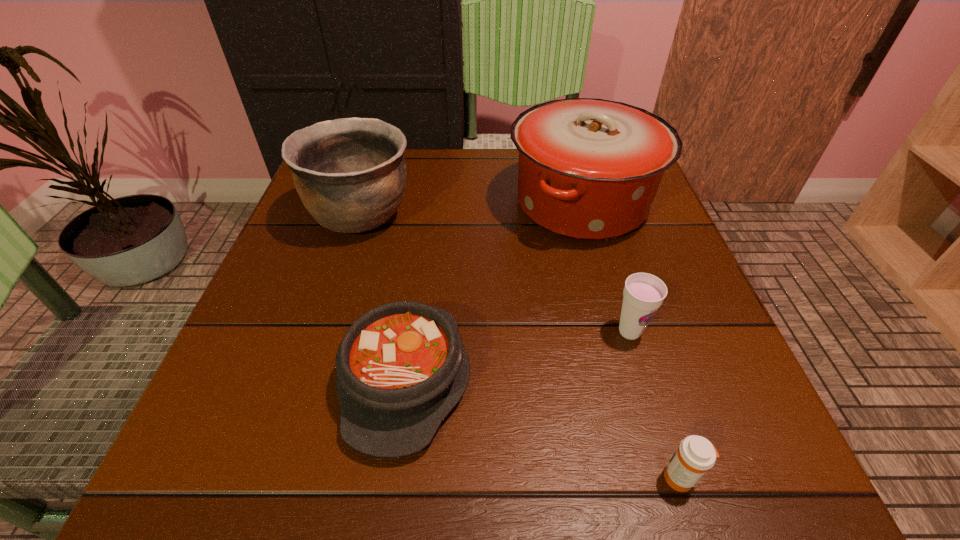
Locate an element on the screen. The height and width of the screenshot is (540, 960). vacant area that lies between the cup and the taller casserole is located at coordinates [x=606, y=267].

In order to click on unoccupied area between the medicine and the third tallest object in this screenshot , I will do `click(655, 404)`.

Identify the location of vacant space in between the tallest object and the medicine. (631, 340).

The image size is (960, 540). What are the coordinates of `empty space that is in between the pottery and the nearer casserole` in the screenshot? It's located at (383, 296).

Where is `empty space between the medicine and the third shortest object`? empty space between the medicine and the third shortest object is located at coordinates (655, 404).

Where is `free spot between the medicine and the nearer casserole`? Image resolution: width=960 pixels, height=540 pixels. free spot between the medicine and the nearer casserole is located at coordinates (543, 428).

Find the location of a particular element. The width and height of the screenshot is (960, 540). free space between the medicine and the taller casserole is located at coordinates (631, 340).

Find the location of `free space between the farther casserole and the cup`. free space between the farther casserole and the cup is located at coordinates (606, 267).

You are a GUI agent. You are given a task and a screenshot of the screen. Output one action in this format:
    pyautogui.click(x=<x>, y=<y>)
    Task: Click on the free space between the left casserole and the third tallest object
    The height and width of the screenshot is (540, 960).
    Given the screenshot: What is the action you would take?
    click(517, 355)

Choose which object is the third nearest neighbor to the left casserole. Please provide its 2D coordinates. Your answer should be formatted as a tuple, i.e. [(x, y)], where the tuple contains the x and y coordinates of a point satisfying the conditions above.

[(643, 294)]